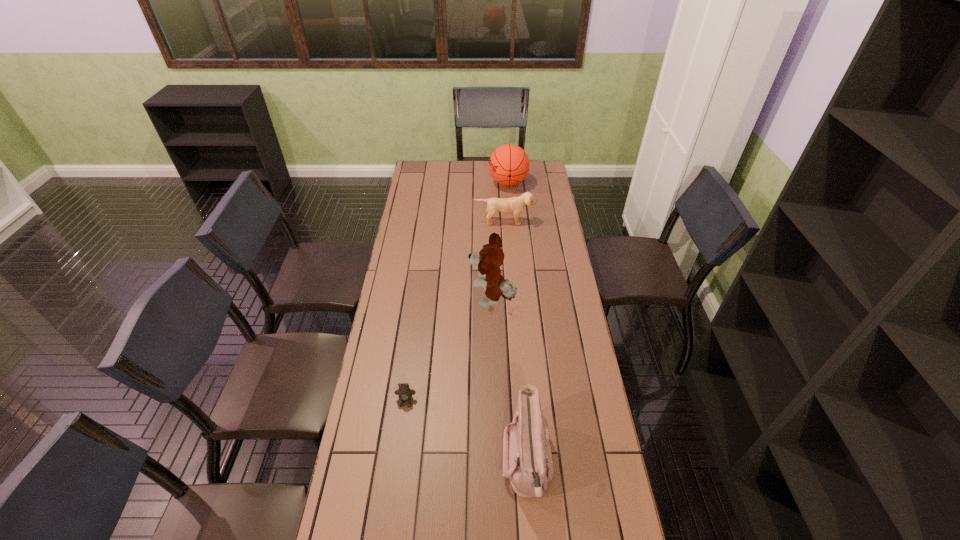
Locate an element on the screen. free space located 0.290m on the face of the third farthest object is located at coordinates (397, 300).

At what (x,y) coordinates should I click in order to perform the action: click on vacant space located 0.110m on the face of the third farthest object. Please return your answer as a coordinate pair (x, y). Image resolution: width=960 pixels, height=540 pixels. Looking at the image, I should click on (442, 300).

Find the location of a particular element. This screenshot has width=960, height=540. free point located 0.130m on the side with logo of the farthest object is located at coordinates (465, 183).

Find the location of a particular element. vacant space located on the side with logo of the farthest object is located at coordinates (447, 183).

What are the coordinates of `blank space located on the side with logo of the farthest object` in the screenshot? It's located at pos(468,183).

This screenshot has height=540, width=960. I want to click on vacant point located on the front pocket of the nearest object, so click(x=485, y=464).

Find the location of `free space located on the front pocket of the nearest object`. free space located on the front pocket of the nearest object is located at coordinates (420, 464).

Where is `vacant space located 0.180m on the front pocket of the nearest object`? This screenshot has width=960, height=540. vacant space located 0.180m on the front pocket of the nearest object is located at coordinates 441,464.

Find the location of a particular element. free space located 0.220m on the left side of the farther puppy is located at coordinates (507, 256).

Where is `vacant region located 0.070m on the face of the shortest object`? The image size is (960, 540). vacant region located 0.070m on the face of the shortest object is located at coordinates (402, 429).